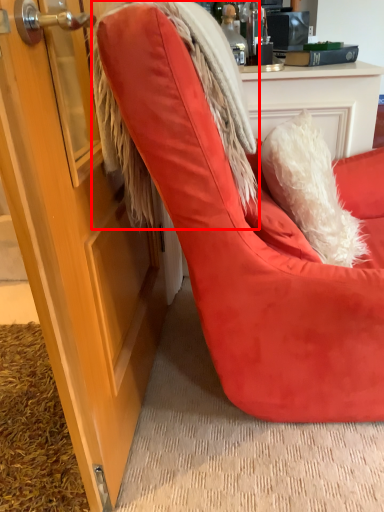
Question: From the image's perspective, where is fur coat (annotated by the red box) located relative to chair?

Choices:
 (A) below
 (B) above

Answer: (B)